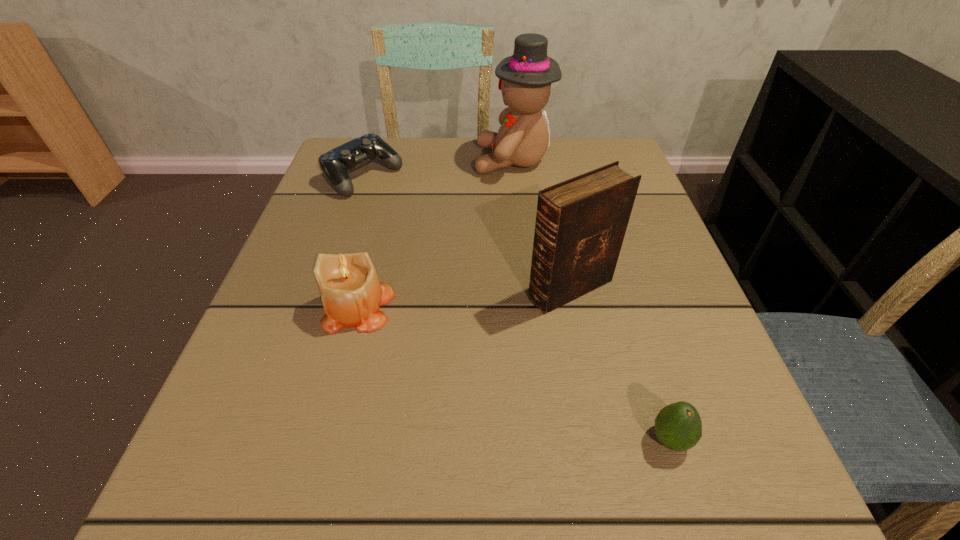
Locate an element on the screen. vacant space positioned 0.260m on the left of the nearest object is located at coordinates (450, 440).

Identify the location of free space located on the right of the control. The image size is (960, 540). (510, 177).

Locate an element on the screen. rag_doll that is at the far edge is located at coordinates (525, 78).

You are a GUI agent. You are given a task and a screenshot of the screen. Output one action in this format:
    pyautogui.click(x=<x>, y=<y>)
    Task: Click on the control that is at the far edge
    The image size is (960, 540).
    Given the screenshot: What is the action you would take?
    pyautogui.click(x=335, y=164)

Identify the location of object located at the near edge. Image resolution: width=960 pixels, height=540 pixels. (678, 426).

Locate an element on the screen. The height and width of the screenshot is (540, 960). candle that is at the left edge is located at coordinates (351, 294).

Locate an element on the screen. The image size is (960, 540). control that is at the left edge is located at coordinates (335, 164).

Where is `Bible located at the right edge`? Bible located at the right edge is located at coordinates (580, 226).

Where is `avocado that is at the right edge`? Image resolution: width=960 pixels, height=540 pixels. avocado that is at the right edge is located at coordinates (678, 426).

Where is `object that is at the far left corner`? object that is at the far left corner is located at coordinates (335, 164).